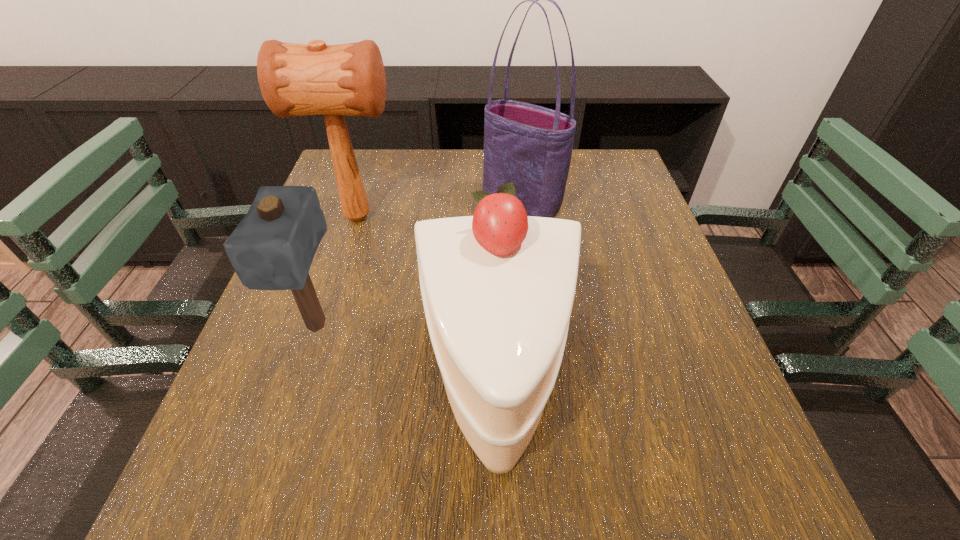
Find the location of a particular element. The width and height of the screenshot is (960, 540). vacant space at the far edge is located at coordinates (484, 150).

In the image, there is a desktop. At what (x,y) coordinates should I click in order to perform the action: click on free space at the near edge. Please return your answer as a coordinate pair (x, y). Looking at the image, I should click on (338, 495).

I want to click on vacant area at the left edge of the desktop, so click(x=286, y=364).

This screenshot has width=960, height=540. I want to click on vacant space at the right edge of the desktop, so click(628, 227).

Locate an element on the screen. The width and height of the screenshot is (960, 540). vacant space at the far left corner of the desktop is located at coordinates (384, 160).

Image resolution: width=960 pixels, height=540 pixels. What are the coordinates of `blank space at the near right corner` in the screenshot? It's located at (699, 502).

This screenshot has height=540, width=960. I want to click on vacant point located between the taller mallet and the nearer mallet, so click(x=337, y=272).

The image size is (960, 540). I want to click on empty location between the farther mallet and the tote bag, so click(x=440, y=210).

Locate an element on the screen. The image size is (960, 540). vacant region between the shorter mallet and the cake is located at coordinates (407, 354).

Where is `vacant point located between the taller mallet and the tote bag`? The image size is (960, 540). vacant point located between the taller mallet and the tote bag is located at coordinates (440, 210).